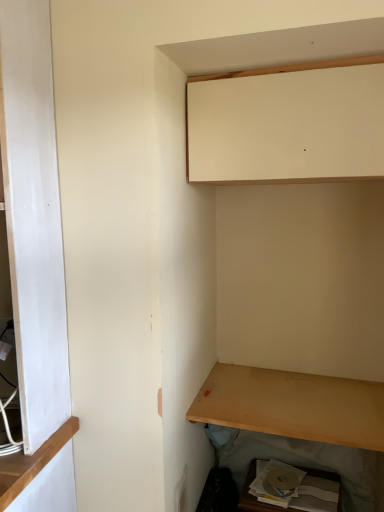
Question: From the image's perspective, is light brown wood shelf at lower right on top of matte cardboard box at lower right, acting as the 2th cabinetry starting from the top?

Choices:
 (A) no
 (B) yes

Answer: (B)

Question: Is light brown wood shelf at lower right facing towards matte cardboard box at lower right, placed as the 1th cabinetry when sorted from bottom to top?

Choices:
 (A) no
 (B) yes

Answer: (A)

Question: Does light brown wood shelf at lower right have a greater width compared to matte cardboard box at lower right, placed as the 1th cabinetry when sorted from bottom to top?

Choices:
 (A) yes
 (B) no

Answer: (A)

Question: Is light brown wood shelf at lower right positioned behind matte cardboard box at lower right, placed as the 1th cabinetry when sorted from bottom to top?

Choices:
 (A) yes
 (B) no

Answer: (B)

Question: From a real-world perspective, is light brown wood shelf at lower right on matte cardboard box at lower right, acting as the 2th cabinetry starting from the top?

Choices:
 (A) no
 (B) yes

Answer: (B)

Question: Considering the relative sizes of light brown wood shelf at lower right and matte cardboard box at lower right, placed as the 1th cabinetry when sorted from bottom to top, in the image provided, is light brown wood shelf at lower right bigger than matte cardboard box at lower right, placed as the 1th cabinetry when sorted from bottom to top,?

Choices:
 (A) yes
 (B) no

Answer: (B)

Question: Considering the relative positions of matte cardboard box at lower right, placed as the 1th cabinetry when sorted from bottom to top, and matte white cabinet at upper center, which is the second cabinetry in bottom-to-top order, in the image provided, is matte cardboard box at lower right, placed as the 1th cabinetry when sorted from bottom to top, in front of matte white cabinet at upper center, which is the second cabinetry in bottom-to-top order,?

Choices:
 (A) no
 (B) yes

Answer: (A)

Question: Considering the relative sizes of matte cardboard box at lower right, placed as the 1th cabinetry when sorted from bottom to top, and matte white cabinet at upper center, the 1th cabinetry viewed from the top, in the image provided, is matte cardboard box at lower right, placed as the 1th cabinetry when sorted from bottom to top, bigger than matte white cabinet at upper center, the 1th cabinetry viewed from the top,?

Choices:
 (A) yes
 (B) no

Answer: (B)

Question: Is matte cardboard box at lower right, acting as the 2th cabinetry starting from the top, at the right side of matte white cabinet at upper center, which is the second cabinetry in bottom-to-top order?

Choices:
 (A) no
 (B) yes

Answer: (B)

Question: From the image's perspective, is matte cardboard box at lower right, placed as the 1th cabinetry when sorted from bottom to top, beneath matte white cabinet at upper center, which is the second cabinetry in bottom-to-top order?

Choices:
 (A) yes
 (B) no

Answer: (A)

Question: From the image's perspective, is matte cardboard box at lower right, acting as the 2th cabinetry starting from the top, above matte white cabinet at upper center, which is the second cabinetry in bottom-to-top order?

Choices:
 (A) yes
 (B) no

Answer: (B)

Question: Considering the relative sizes of matte cardboard box at lower right, acting as the 2th cabinetry starting from the top, and matte white cabinet at upper center, the 1th cabinetry viewed from the top, in the image provided, is matte cardboard box at lower right, acting as the 2th cabinetry starting from the top, wider than matte white cabinet at upper center, the 1th cabinetry viewed from the top,?

Choices:
 (A) yes
 (B) no

Answer: (B)

Question: Is the surface of matte white cabinet at upper center, which is the second cabinetry in bottom-to-top order, in direct contact with matte cardboard box at lower right, placed as the 1th cabinetry when sorted from bottom to top?

Choices:
 (A) yes
 (B) no

Answer: (B)